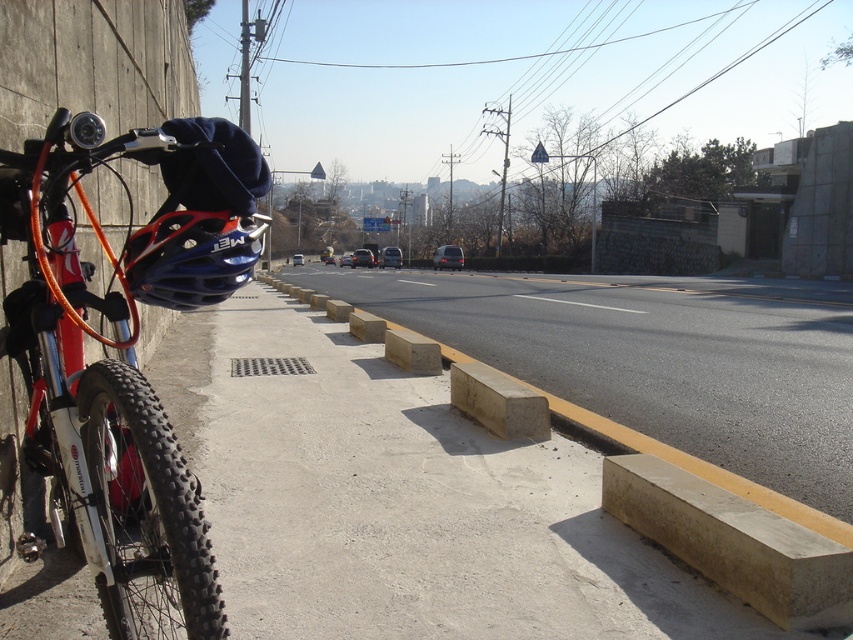
Based on the photo, which is more to the left, concrete at left or shiny red bicycle at left?

From the viewer's perspective, shiny red bicycle at left appears more on the left side.

Which is in front, point (225, 445) or point (47, 220)?

Point (47, 220) is more forward.

Locate an element on the screen. This screenshot has width=853, height=640. concrete at left is located at coordinates (401, 500).